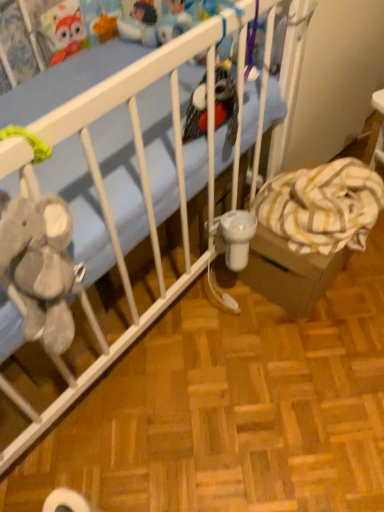
Question: Is yellow striped blanket at lower right to the left of velvety plush bird at center, acting as the 1th toy starting from the front, from the viewer's perspective?

Choices:
 (A) no
 (B) yes

Answer: (A)

Question: Can you confirm if yellow striped blanket at lower right is wider than velvety plush bird at center, which ranks as the 2th toy in back-to-front order?

Choices:
 (A) no
 (B) yes

Answer: (B)

Question: From the image's perspective, is yellow striped blanket at lower right on velvety plush bird at center, the 2th toy viewed from the top?

Choices:
 (A) yes
 (B) no

Answer: (B)

Question: Is yellow striped blanket at lower right positioned with its back to velvety plush bird at center, the 2th toy viewed from the top?

Choices:
 (A) no
 (B) yes

Answer: (A)

Question: Is yellow striped blanket at lower right placed right next to velvety plush bird at center, the second toy from the left?

Choices:
 (A) yes
 (B) no

Answer: (B)

Question: Considering the relative sizes of yellow striped blanket at lower right and velvety plush bird at center, which ranks as the 2th toy in back-to-front order, in the image provided, is yellow striped blanket at lower right smaller than velvety plush bird at center, which ranks as the 2th toy in back-to-front order,?

Choices:
 (A) yes
 (B) no

Answer: (B)

Question: Is velvety plush bird at center, the second toy from the left, at the back of matte plastic toy at upper center, arranged as the first toy when viewed from the back?

Choices:
 (A) no
 (B) yes

Answer: (A)

Question: Considering the relative sizes of matte plastic toy at upper center, which is counted as the first toy, starting from the left, and velvety plush bird at center, which ranks as the 2th toy in back-to-front order, in the image provided, is matte plastic toy at upper center, which is counted as the first toy, starting from the left, wider than velvety plush bird at center, which ranks as the 2th toy in back-to-front order,?

Choices:
 (A) yes
 (B) no

Answer: (B)

Question: Can you confirm if matte plastic toy at upper center, which appears as the 1th toy when viewed from the top, is bigger than velvety plush bird at center, acting as the 1th toy starting from the front?

Choices:
 (A) no
 (B) yes

Answer: (A)

Question: Does matte plastic toy at upper center, arranged as the first toy when viewed from the back, come behind velvety plush bird at center, which is the 1th toy from bottom to top?

Choices:
 (A) no
 (B) yes

Answer: (B)

Question: Is matte plastic toy at upper center, acting as the second toy starting from the right, surrounding velvety plush bird at center, the 1th toy in the right-to-left sequence?

Choices:
 (A) yes
 (B) no

Answer: (B)

Question: From the image's perspective, is matte plastic toy at upper center, which is counted as the first toy, starting from the left, on velvety plush bird at center, the second toy from the left?

Choices:
 (A) yes
 (B) no

Answer: (A)

Question: From a real-world perspective, is blue fabric crib at upper left located higher than velvety plush bird at center, which ranks as the 2th toy in back-to-front order?

Choices:
 (A) yes
 (B) no

Answer: (B)